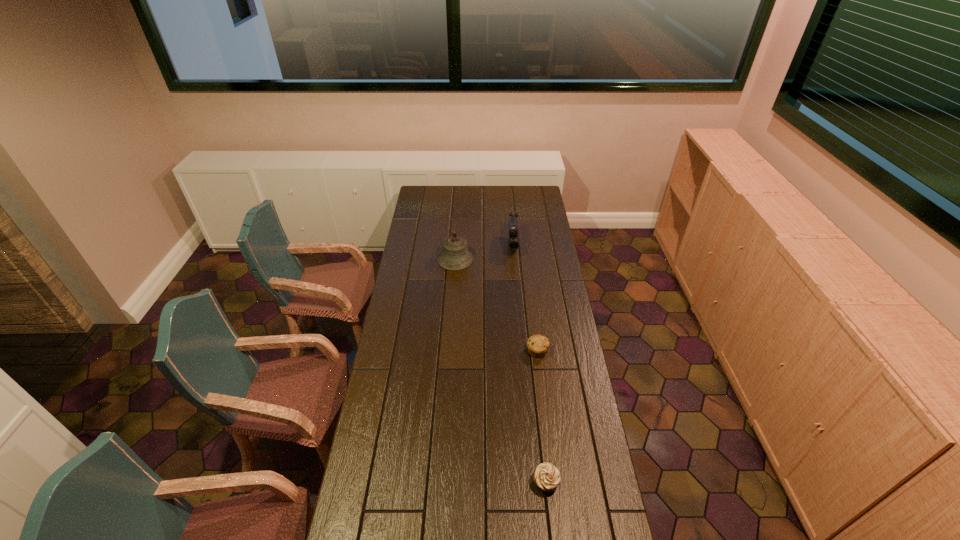
The height and width of the screenshot is (540, 960). In order to click on bell in this screenshot , I will do `click(455, 256)`.

Where is `camcorder`? camcorder is located at coordinates (513, 237).

This screenshot has width=960, height=540. What are the coordinates of `the second nearest object` in the screenshot? It's located at (537, 345).

Locate an element on the screen. The image size is (960, 540). the nearest object is located at coordinates (546, 476).

Where is `vacant space located on the right of the leftmost object`? This screenshot has width=960, height=540. vacant space located on the right of the leftmost object is located at coordinates (506, 259).

Identify the location of vacant space situated 0.050m on the front-facing side of the camcorder. The height and width of the screenshot is (540, 960). (515, 266).

Where is `free location located on the front of the farther muffin`? free location located on the front of the farther muffin is located at coordinates (548, 437).

The image size is (960, 540). In order to click on free point located on the left of the nearest object in this screenshot , I will do `click(449, 482)`.

You are a GUI agent. You are given a task and a screenshot of the screen. Output one action in this format:
    pyautogui.click(x=<x>, y=<y>)
    Task: Click on the free space at the left edge of the desktop
    Image resolution: width=960 pixels, height=540 pixels.
    Given the screenshot: What is the action you would take?
    pyautogui.click(x=433, y=226)

At what (x,y) coordinates should I click in order to perform the action: click on vacant space at the right edge of the desktop. Please return your answer as a coordinate pair (x, y). Looking at the image, I should click on (564, 448).